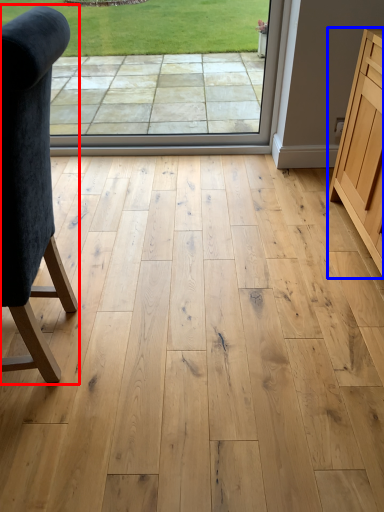
Question: Which point is further to the camera, chair (highlighted by a red box) or cabinetry (highlighted by a blue box)?

Choices:
 (A) chair
 (B) cabinetry

Answer: (B)